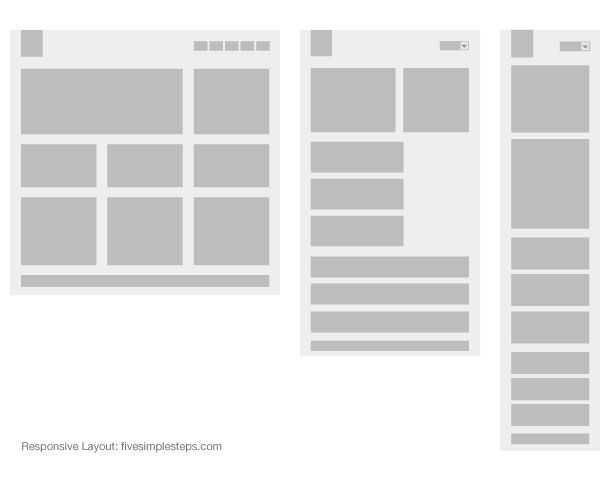
This screenshot has width=610, height=480. What are the coordinates of `"layout"` in the screenshot? It's located at (96, 443).